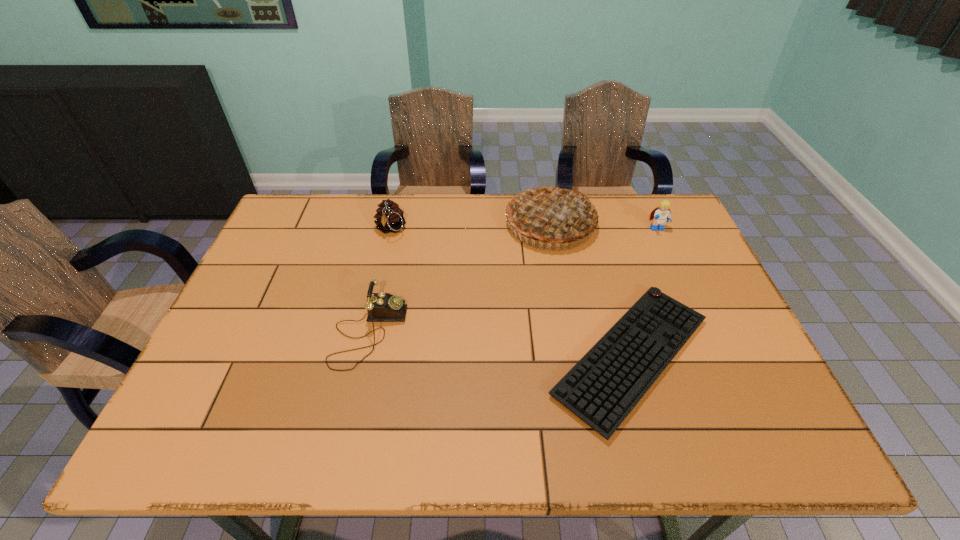
Where is `pie located in the far edge section of the desktop`? The width and height of the screenshot is (960, 540). pie located in the far edge section of the desktop is located at coordinates (552, 213).

Find the location of a particular element. The width and height of the screenshot is (960, 540). pinecone positioned at the far edge is located at coordinates (389, 217).

Identify the location of Lego present at the far edge. (662, 214).

Find the location of a particular element. This screenshot has width=960, height=540. object positioned at the near edge is located at coordinates (602, 389).

The image size is (960, 540). I want to click on Lego that is at the right edge, so click(662, 214).

This screenshot has height=540, width=960. I want to click on computer keyboard positioned at the right edge, so click(x=602, y=389).

At what (x,y) coordinates should I click in order to perform the action: click on object present at the far right corner. Please return your answer as a coordinate pair (x, y). Looking at the image, I should click on (662, 214).

Find the location of `object at the near right corner`. object at the near right corner is located at coordinates [x=602, y=389].

I want to click on vacant space at the far edge, so click(x=502, y=231).

Identify the location of vacant space at the near edge of the desktop. (354, 444).